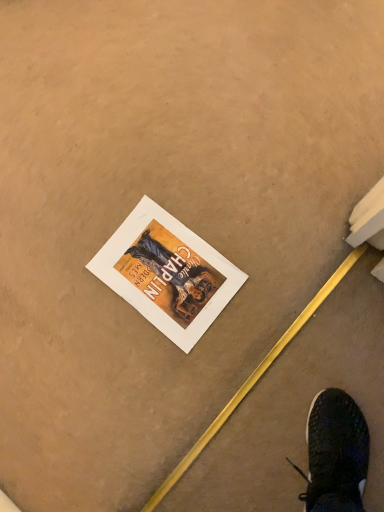
Describe the element at coordinates (167, 273) in the screenshot. I see `matte paper poster at center` at that location.

Measure the distance between point (x=149, y=290) and camera.

The distance of point (x=149, y=290) from camera is 36.26 inches.

Locate an element on the screen. This screenshot has height=512, width=384. matte paper poster at center is located at coordinates (167, 273).

Where is `matte paper poster at center`? This screenshot has width=384, height=512. matte paper poster at center is located at coordinates (167, 273).